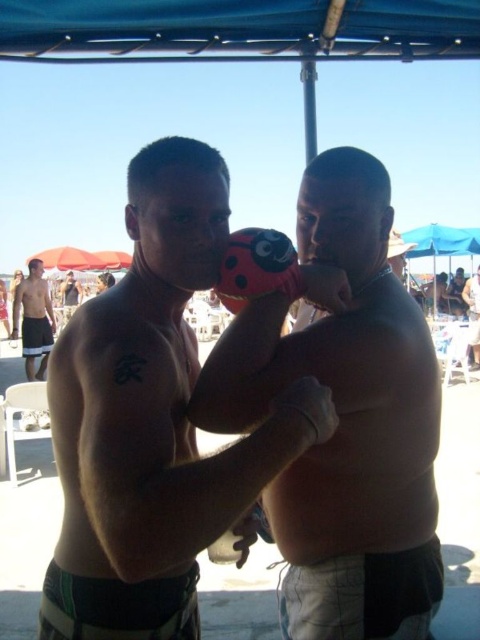
Between smooth skin man at center and shiny metallic helmet at center, which one is positioned lower?

smooth skin man at center

Does smooth skin man at center appear on the left side of shiny metallic helmet at center?

No, smooth skin man at center is not to the left of shiny metallic helmet at center.

Which is behind, point (476, 328) or point (64, 307)?

Point (64, 307)

At what (x,y) coordinates should I click in order to perform the action: click on smooth skin man at center. Please return your answer as a coordinate pair (x, y). The height and width of the screenshot is (640, 480). Looking at the image, I should click on (472, 314).

Can you confirm if matte black boxing glove at center is positioned above pink matte boxing glove at center?

Indeed, matte black boxing glove at center is positioned over pink matte boxing glove at center.

Between point (68, 525) and point (335, 541), which one is positioned behind?

The point (335, 541) is behind.

What do you see at coordinates (154, 420) in the screenshot? The height and width of the screenshot is (640, 480). I see `matte black boxing glove at center` at bounding box center [154, 420].

The image size is (480, 640). Identify the location of matte black boxing glove at center. (154, 420).

Who is more forward, (39,378) or (73,300)?

Point (39,378) is in front.

Can you confirm if shiny black shorts at left is positioned below shiny metallic helmet at center?

Indeed, shiny black shorts at left is positioned under shiny metallic helmet at center.

You are a GUI agent. You are given a task and a screenshot of the screen. Output one action in this format:
    pyautogui.click(x=<x>, y=<y>)
    Task: Click on the shiny black shorts at left
    Image resolution: width=480 pixels, height=640 pixels.
    Given the screenshot: What is the action you would take?
    pyautogui.click(x=34, y=320)